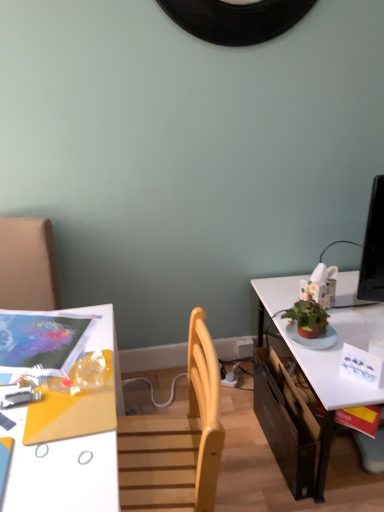
Question: Does matte plastic magazine at upper left have a greater height compared to white glossy table at right?

Choices:
 (A) yes
 (B) no

Answer: (B)

Question: Can you confirm if matte plastic magazine at upper left is shorter than white glossy table at right?

Choices:
 (A) yes
 (B) no

Answer: (A)

Question: Is matte plastic magazine at upper left further to the viewer compared to white glossy table at right?

Choices:
 (A) yes
 (B) no

Answer: (B)

Question: Can we say matte plastic magazine at upper left lies outside white glossy table at right?

Choices:
 (A) no
 (B) yes

Answer: (B)

Question: Is white glossy table at right at the back of matte plastic magazine at upper left?

Choices:
 (A) yes
 (B) no

Answer: (B)

Question: Does matte plastic magazine at upper left contain white glossy table at right?

Choices:
 (A) yes
 (B) no

Answer: (B)

Question: Can you confirm if white glossy table at right is bigger than white glossy desk at lower left?

Choices:
 (A) yes
 (B) no

Answer: (A)

Question: Can you confirm if white glossy table at right is positioned to the left of white glossy desk at lower left?

Choices:
 (A) no
 (B) yes

Answer: (A)

Question: From a real-world perspective, is white glossy table at right positioned over white glossy desk at lower left based on gravity?

Choices:
 (A) no
 (B) yes

Answer: (A)

Question: Is white glossy table at right not near white glossy desk at lower left?

Choices:
 (A) yes
 (B) no

Answer: (B)

Question: Is white glossy table at right thinner than white glossy desk at lower left?

Choices:
 (A) no
 (B) yes

Answer: (A)

Question: Is white glossy table at right closer to the viewer compared to white glossy desk at lower left?

Choices:
 (A) no
 (B) yes

Answer: (A)

Question: Does matte plastic magazine at upper left have a lesser width compared to black cardboard drawer at lower right?

Choices:
 (A) yes
 (B) no

Answer: (B)